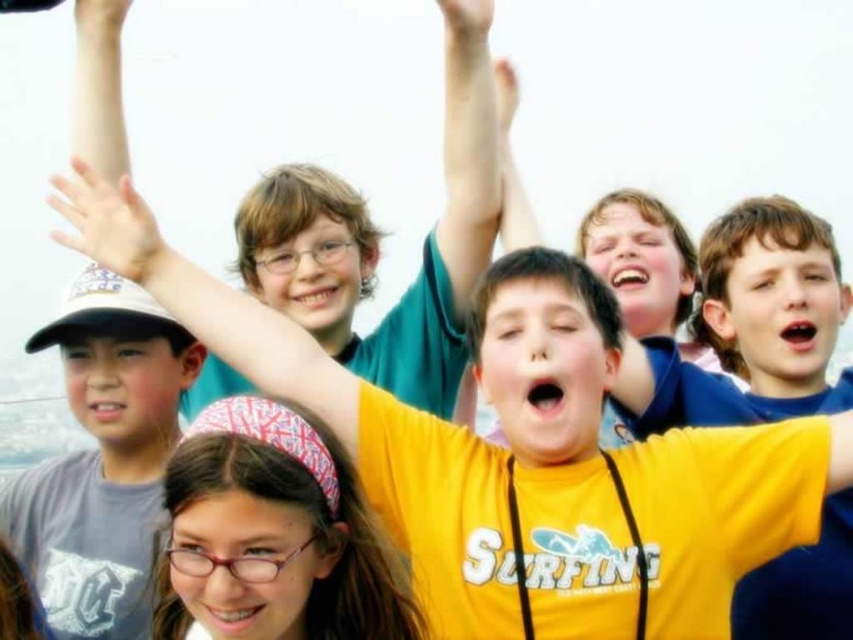
You are a photographer trying to capture the exact position of the hands in the image. Which hand is located to the left of the other between the matte skin hand at upper center and the white matte hand at upper center?

The matte skin hand at upper center is positioned on the left side of white matte hand at upper center.